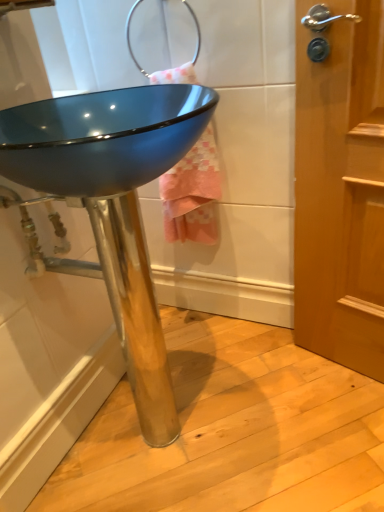
You are a GUI agent. You are given a task and a screenshot of the screen. Output one action in this format:
    pyautogui.click(x=<x>, y=<y>)
    Task: Click on the pink textured towel at upper center
    
    Given the screenshot: What is the action you would take?
    pyautogui.click(x=193, y=193)

Describe the element at coordinates (193, 193) in the screenshot. I see `pink textured towel at upper center` at that location.

What is the approximate height of pink textured towel at upper center?

pink textured towel at upper center is 21.42 inches in height.

What is the approximate width of pink textured towel at upper center?

The width of pink textured towel at upper center is 14.51 centimeters.

What do you see at coordinates (111, 206) in the screenshot? I see `glossy blue basin at center` at bounding box center [111, 206].

Where is `glossy blue basin at center`? glossy blue basin at center is located at coordinates (111, 206).

What are the coordinates of `pink textured towel at upper center` in the screenshot? It's located at (193, 193).

Between pink textured towel at upper center and glossy blue basin at center, which one appears on the right side from the viewer's perspective?

pink textured towel at upper center is more to the right.

Is pink textured towel at upper center closer to camera compared to glossy blue basin at center?

No, pink textured towel at upper center is further to the viewer.

Which is behind, point (208, 170) or point (106, 205)?

Point (208, 170)

From the image's perspective, is pink textured towel at upper center located beneath glossy blue basin at center?

Incorrect, from the image's perspective, pink textured towel at upper center is higher than glossy blue basin at center.

Based on the photo, from a real-world perspective, is pink textured towel at upper center over glossy blue basin at center?

Yes, from a real-world perspective, pink textured towel at upper center is over glossy blue basin at center

Is pink textured towel at upper center wider than glossy blue basin at center?

No.

Does pink textured towel at upper center have a greater height compared to glossy blue basin at center?

No, pink textured towel at upper center is not taller than glossy blue basin at center.

Based on their sizes in the image, would you say pink textured towel at upper center is bigger or smaller than glossy blue basin at center?

Considering their sizes, pink textured towel at upper center takes up less space than glossy blue basin at center.

Would you say pink textured towel at upper center contains glossy blue basin at center?

No, glossy blue basin at center is not surrounded by pink textured towel at upper center.

Is pink textured towel at upper center far away from glossy blue basin at center?

Actually, pink textured towel at upper center and glossy blue basin at center are a little close together.

Is pink textured towel at upper center facing away from glossy blue basin at center?

No, pink textured towel at upper center's orientation is not away from glossy blue basin at center.

Based on the photo, how many degrees apart are the facing directions of pink textured towel at upper center and glossy blue basin at center?

There is a 91.3-degree angle between the facing directions of pink textured towel at upper center and glossy blue basin at center.

Find the location of `sink located in front of the pink textured towel at upper center`. sink located in front of the pink textured towel at upper center is located at coordinates (111, 206).

Would you say glossy blue basin at center is to the left or to the right of pink textured towel at upper center in the picture?

Clearly, glossy blue basin at center is on the left of pink textured towel at upper center in the image.

Between glossy blue basin at center and pink textured towel at upper center, which one is positioned behind?

Positioned behind is pink textured towel at upper center.

Considering the points (140, 139) and (169, 69), which point is in front, point (140, 139) or point (169, 69)?

The point (169, 69) is closer to the camera.

From the image's perspective, which is above, glossy blue basin at center or pink textured towel at upper center?

pink textured towel at upper center, from the image's perspective.

From a real-world perspective, is glossy blue basin at center beneath pink textured towel at upper center?

Indeed, from a real-world perspective, glossy blue basin at center is positioned beneath pink textured towel at upper center.

Which object is wider, glossy blue basin at center or pink textured towel at upper center?

glossy blue basin at center is wider.

Who is taller, glossy blue basin at center or pink textured towel at upper center?

glossy blue basin at center.

Can you confirm if glossy blue basin at center is smaller than pink textured towel at upper center?

No.

Is glossy blue basin at center not inside pink textured towel at upper center?

glossy blue basin at center is positioned outside pink textured towel at upper center.

Is glossy blue basin at center not near pink textured towel at upper center?

No, glossy blue basin at center is not far away from pink textured towel at upper center.

Is glossy blue basin at center oriented away from pink textured towel at upper center?

No, glossy blue basin at center is not facing the opposite direction of pink textured towel at upper center.

Measure the distance between glossy blue basin at center and pink textured towel at upper center.

glossy blue basin at center is 9.39 inches from pink textured towel at upper center.

In the image, there is a pink textured towel at upper center. Where is `sink below it (from a real-world perspective)`? The image size is (384, 512). sink below it (from a real-world perspective) is located at coordinates (111, 206).

Image resolution: width=384 pixels, height=512 pixels. Identify the location of bath towel that appears behind the glossy blue basin at center. (193, 193).

At what (x,y) coordinates should I click in order to perform the action: click on bath towel on the right of glossy blue basin at center. Please return your answer as a coordinate pair (x, y). This screenshot has height=512, width=384. Looking at the image, I should click on (193, 193).